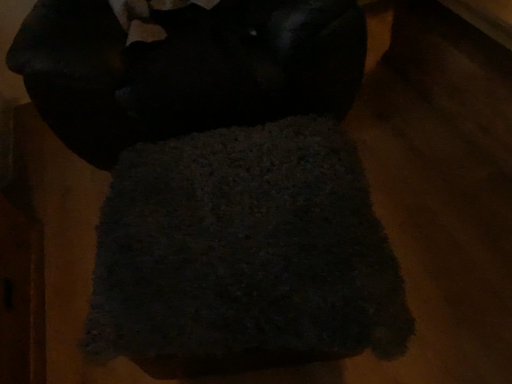
Question: Is dark textured towel at center taller than dark wool rug at center?

Choices:
 (A) no
 (B) yes

Answer: (A)

Question: From a real-world perspective, is dark textured towel at center below dark wool rug at center?

Choices:
 (A) yes
 (B) no

Answer: (A)

Question: Does dark textured towel at center have a lesser height compared to dark wool rug at center?

Choices:
 (A) yes
 (B) no

Answer: (A)

Question: Could you tell me if dark textured towel at center is facing dark wool rug at center?

Choices:
 (A) no
 (B) yes

Answer: (A)

Question: Is dark wool rug at center inside dark textured towel at center?

Choices:
 (A) no
 (B) yes

Answer: (A)

Question: Can you confirm if dark textured towel at center is positioned to the right of dark wool rug at center?

Choices:
 (A) no
 (B) yes

Answer: (B)

Question: From a real-world perspective, is dark wool rug at center beneath dark textured towel at center?

Choices:
 (A) yes
 (B) no

Answer: (B)

Question: From a real-world perspective, does dark wool rug at center stand above dark textured towel at center?

Choices:
 (A) yes
 (B) no

Answer: (A)

Question: Is dark wool rug at center taller than dark textured towel at center?

Choices:
 (A) yes
 (B) no

Answer: (A)

Question: From the image's perspective, is dark wool rug at center below dark textured towel at center?

Choices:
 (A) yes
 (B) no

Answer: (B)

Question: Can you confirm if dark wool rug at center is positioned to the right of dark textured towel at center?

Choices:
 (A) no
 (B) yes

Answer: (A)

Question: Is the surface of dark wool rug at center in direct contact with dark textured towel at center?

Choices:
 (A) no
 (B) yes

Answer: (A)

Question: From their relative heights in the image, would you say dark textured towel at center is taller or shorter than dark wool rug at center?

Choices:
 (A) short
 (B) tall

Answer: (A)